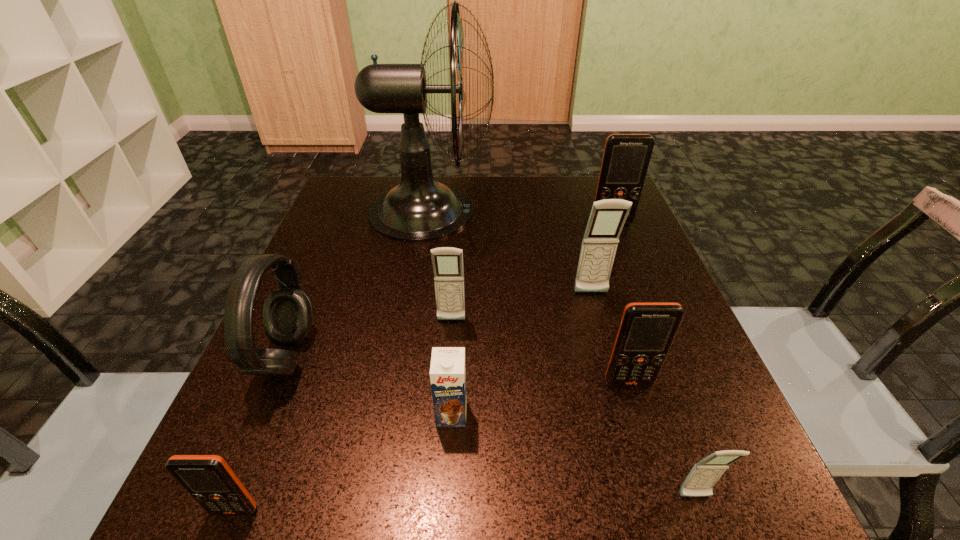
Locate which cellular telephone ranks in proximity to the biggest orange cellular telephone. Please provide its 2D coordinates. Your answer should be formatted as a tuple, i.e. [(x, y)], where the tuple contains the x and y coordinates of a point satisfying the conditions above.

[(607, 217)]

Choose which gray cellular telephone is the second nearest neighbor to the smallest gray cellular telephone. Please provide its 2D coordinates. Your answer should be formatted as a tuple, i.e. [(x, y)], where the tuple contains the x and y coordinates of a point satisfying the conditions above.

[(447, 262)]

The height and width of the screenshot is (540, 960). Identify the location of gray cellular telephone that can be found as the closest to the leftmost orange cellular telephone. (447, 262).

Where is `orange cellular telephone that stands as the third closest to the chocolate milk`? The height and width of the screenshot is (540, 960). orange cellular telephone that stands as the third closest to the chocolate milk is located at coordinates (626, 157).

Select which orange cellular telephone is the closest to the farthest gray cellular telephone. Please provide its 2D coordinates. Your answer should be formatted as a tuple, i.e. [(x, y)], where the tuple contains the x and y coordinates of a point satisfying the conditions above.

[(647, 330)]

Locate an element on the screen. This screenshot has height=540, width=960. free point that satisfies the following two spatial constraints: 1. on the front-facing side of the second nearest gray cellular telephone; 2. on the earcups of the headset is located at coordinates (449, 356).